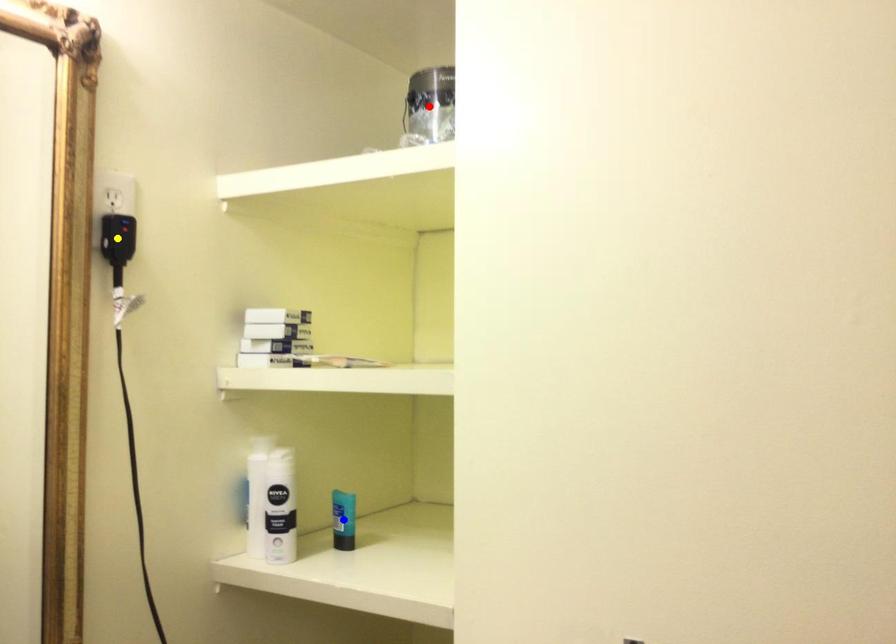
Order these from nearest to farthest:
yellow point, red point, blue point

1. blue point
2. red point
3. yellow point